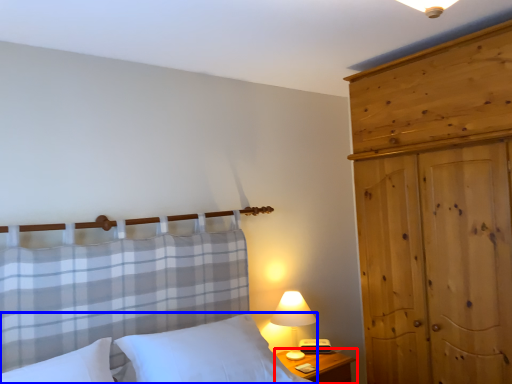
Question: Which of the following is the closest to the observer, nightstand (highlighted by a red box) or bed (highlighted by a blue box)?

Choices:
 (A) nightstand
 (B) bed

Answer: (B)